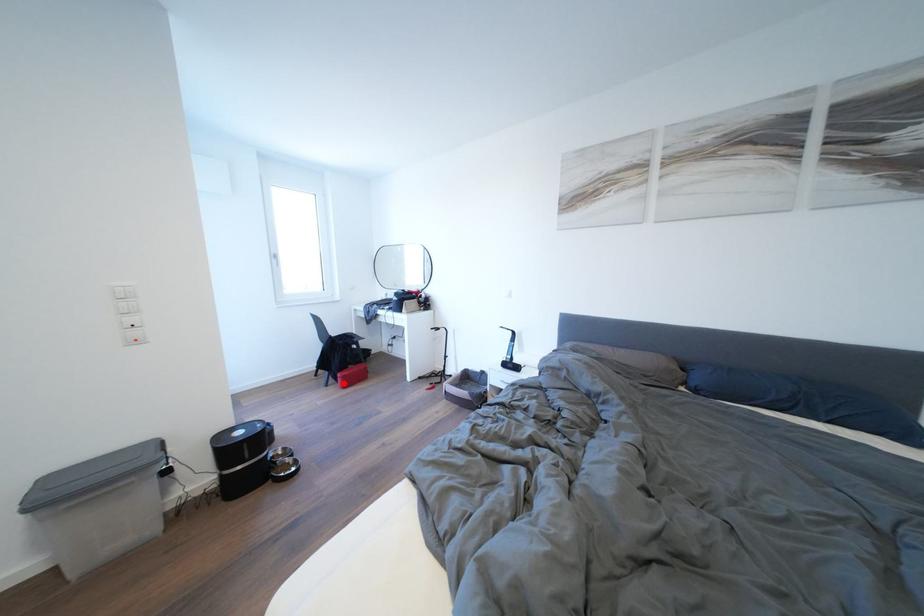
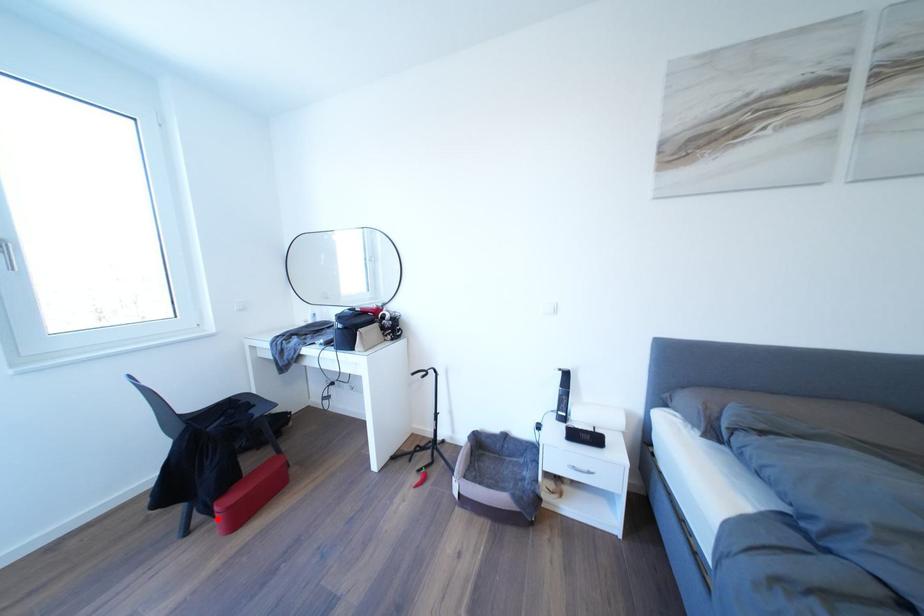
I am providing you with two images of the same scene from different viewpoints. A red point is marked on the first image and another point is marked on the second image. Is the marked point in image1 the same physical position as the marked point in image2?

Yes